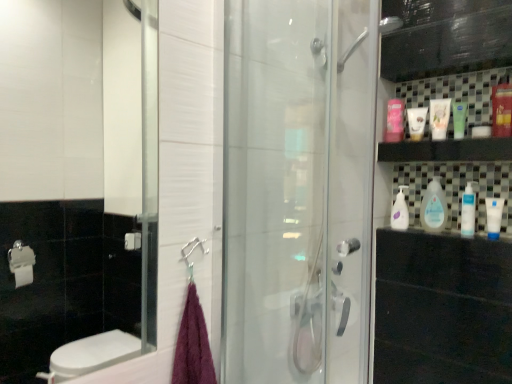
The height and width of the screenshot is (384, 512). What do you see at coordinates (298, 190) in the screenshot?
I see `transparent glass shower door at center` at bounding box center [298, 190].

From the picture: In order to face green matte tube at upper right, which is the third mouthwash in right-to-left order, should I rotate leftwards or rightwards?

It's best to rotate right around 25.466 degrees.

What is the approximate height of green matte tube at upper right, arranged as the 4th mouthwash when viewed from the left?

5.98 inches.

In order to face clear plastic bottle at center, acting as the second cleaning product starting from the front, should I rotate leftwards or rightwards?

Rotate your view right by about 22.633°.

The height and width of the screenshot is (384, 512). What do you see at coordinates (502, 110) in the screenshot?
I see `red plastic mouthwash at upper right, which ranks as the 1th mouthwash in right-to-left order` at bounding box center [502, 110].

Locate an element on the screen. The width and height of the screenshot is (512, 384). blue matte tube at right, acting as the second mouthwash starting from the right is located at coordinates (494, 216).

From the image's perspective, which one is positioned higher, purple fluffy towel at lower left or transparent glass shower door at center?

transparent glass shower door at center is shown above in the image.

Based on the photo, which object is further away from the camera, purple fluffy towel at lower left or transparent glass shower door at center?

purple fluffy towel at lower left is further from the camera.

Does purple fluffy towel at lower left have a greater width compared to transparent glass shower door at center?

No.

Is clear plastic bottle at center, the second cleaning product positioned from the right, located within blue matte tube at right, positioned as the fifth mouthwash in left-to-right order?

No, clear plastic bottle at center, the second cleaning product positioned from the right, is not inside blue matte tube at right, positioned as the fifth mouthwash in left-to-right order.

Is blue matte tube at right, positioned as the fifth mouthwash in left-to-right order, facing away from clear plastic bottle at center, marked as the 2th cleaning product in a back-to-front arrangement?

That's not correct — blue matte tube at right, positioned as the fifth mouthwash in left-to-right order, is not looking away from clear plastic bottle at center, marked as the 2th cleaning product in a back-to-front arrangement.

Based on the photo, considering the relative positions of blue matte tube at right, positioned as the fifth mouthwash in left-to-right order, and clear plastic bottle at center, marked as the 2th cleaning product in a back-to-front arrangement, in the image provided, is blue matte tube at right, positioned as the fifth mouthwash in left-to-right order, to the left of clear plastic bottle at center, marked as the 2th cleaning product in a back-to-front arrangement, from the viewer's perspective?

Incorrect, blue matte tube at right, positioned as the fifth mouthwash in left-to-right order, is not on the left side of clear plastic bottle at center, marked as the 2th cleaning product in a back-to-front arrangement.

Is point (489, 201) closer to viewer compared to point (422, 207)?

Yes, point (489, 201) is closer to viewer.

From the image's perspective, is pink glossy mouthwash at upper right, the sixth mouthwash when ordered from right to left, beneath clear plastic bottle at center, the second cleaning product positioned from the right?

No, from the image's perspective, pink glossy mouthwash at upper right, the sixth mouthwash when ordered from right to left, is not below clear plastic bottle at center, the second cleaning product positioned from the right.

Would you say pink glossy mouthwash at upper right, the sixth mouthwash when ordered from right to left, is outside clear plastic bottle at center, marked as the 2th cleaning product in a back-to-front arrangement?

Yes, pink glossy mouthwash at upper right, the sixth mouthwash when ordered from right to left, is outside of clear plastic bottle at center, marked as the 2th cleaning product in a back-to-front arrangement.

From their relative heights in the image, would you say pink glossy mouthwash at upper right, marked as the 1th mouthwash in a left-to-right arrangement, is taller or shorter than clear plastic bottle at center, the second cleaning product positioned from the right?

Clearly, pink glossy mouthwash at upper right, marked as the 1th mouthwash in a left-to-right arrangement, is shorter compared to clear plastic bottle at center, the second cleaning product positioned from the right.

Identify the location of the 1st cleaning product below the pink glossy mouthwash at upper right, marked as the 1th mouthwash in a left-to-right arrangement (from the image's perspective). (434, 207).

Can you confirm if white matte tube at upper right, the 2th mouthwash in the left-to-right sequence, is bigger than red plastic mouthwash at upper right, which is counted as the 6th mouthwash, starting from the left?

No, white matte tube at upper right, the 2th mouthwash in the left-to-right sequence, is not bigger than red plastic mouthwash at upper right, which is counted as the 6th mouthwash, starting from the left.

Is point (414, 126) closer to camera compared to point (493, 123)?

No, it is behind (493, 123).

Between white matte tube at upper right, the 2th mouthwash in the left-to-right sequence, and red plastic mouthwash at upper right, which ranks as the 1th mouthwash in right-to-left order, which one has larger width?

red plastic mouthwash at upper right, which ranks as the 1th mouthwash in right-to-left order.

From the image's perspective, is white matte tube at upper right, the 5th mouthwash when ordered from right to left, on red plastic mouthwash at upper right, which is counted as the 6th mouthwash, starting from the left?

Incorrect, from the image's perspective, white matte tube at upper right, the 5th mouthwash when ordered from right to left, is lower than red plastic mouthwash at upper right, which is counted as the 6th mouthwash, starting from the left.

Is transparent glass shower door at center bigger or smaller than red plastic mouthwash at upper right, which ranks as the 1th mouthwash in right-to-left order?

transparent glass shower door at center is bigger than red plastic mouthwash at upper right, which ranks as the 1th mouthwash in right-to-left order.

Is transparent glass shower door at center in front of or behind red plastic mouthwash at upper right, which ranks as the 1th mouthwash in right-to-left order, in the image?

transparent glass shower door at center is in front of red plastic mouthwash at upper right, which ranks as the 1th mouthwash in right-to-left order.

From the image's perspective, is clear plastic bottle at center, the 2th cleaning product positioned from the left, located beneath green matte tube at upper right, arranged as the 4th mouthwash when viewed from the left?

Yes, from the image's perspective, clear plastic bottle at center, the 2th cleaning product positioned from the left, is below green matte tube at upper right, arranged as the 4th mouthwash when viewed from the left.

Can you tell me how much clear plastic bottle at center, the 2th cleaning product positioned from the left, and green matte tube at upper right, which is the third mouthwash in right-to-left order, differ in facing direction?

They differ by 0.00483 degrees in their facing directions.

From the green matte tube at upper right, which is the third mouthwash in right-to-left order, count 2nd cleaning products backward and point to it. Please provide its 2D coordinates.

[(434, 207)]

Looking at the image, does blue matte tube at right, positioned as the fifth mouthwash in left-to-right order, seem bigger or smaller compared to white glossy tube at upper right, the fourth mouthwash positioned from the right?

Considering their sizes, blue matte tube at right, positioned as the fifth mouthwash in left-to-right order, takes up less space than white glossy tube at upper right, the fourth mouthwash positioned from the right.

Are blue matte tube at right, positioned as the fifth mouthwash in left-to-right order, and white glossy tube at upper right, the fourth mouthwash positioned from the right, far apart?

blue matte tube at right, positioned as the fifth mouthwash in left-to-right order, is near white glossy tube at upper right, the fourth mouthwash positioned from the right, not far away.

Does blue matte tube at right, acting as the second mouthwash starting from the right, have a greater height compared to white glossy tube at upper right, the fourth mouthwash positioned from the right?

In fact, blue matte tube at right, acting as the second mouthwash starting from the right, may be shorter than white glossy tube at upper right, the fourth mouthwash positioned from the right.

Is blue matte tube at right, acting as the second mouthwash starting from the right, aimed at white glossy tube at upper right, arranged as the third mouthwash when viewed from the left?

No, blue matte tube at right, acting as the second mouthwash starting from the right, does not turn towards white glossy tube at upper right, arranged as the third mouthwash when viewed from the left.

Locate an element on the screen. The image size is (512, 384). screen door above the purple fluffy towel at lower left (from a real-world perspective) is located at coordinates (298, 190).

This screenshot has height=384, width=512. I want to click on the 2nd cleaning product to the left when counting from the blue matte tube at right, acting as the second mouthwash starting from the right, so click(x=434, y=207).

Estimate the real-world distances between objects in this image. Which object is closer to green matte tube at upper right, which is the third mouthwash in right-to-left order, clear plastic bottle at center, marked as the 2th cleaning product in a back-to-front arrangement, or purple fluffy towel at lower left?

Among the two, clear plastic bottle at center, marked as the 2th cleaning product in a back-to-front arrangement, is located nearer to green matte tube at upper right, which is the third mouthwash in right-to-left order.

From the image, which object appears to be nearer to white glossy bottle at upper right, the first cleaning product viewed from the left, clear plastic bottle at center, the 2th cleaning product positioned from the left, or blue matte tube at right, positioned as the fifth mouthwash in left-to-right order?

clear plastic bottle at center, the 2th cleaning product positioned from the left, is closer to white glossy bottle at upper right, the first cleaning product viewed from the left.

Looking at the image, which one is located closer to white matte tube at upper right, the 5th mouthwash when ordered from right to left, white glossy bottle at right, which is counted as the 1th cleaning product, starting from the front, or clear plastic bottle at center, the 2th cleaning product positioned from the left?

clear plastic bottle at center, the 2th cleaning product positioned from the left, lies closer to white matte tube at upper right, the 5th mouthwash when ordered from right to left, than the other object.

From the image, which object appears to be nearer to purple fluffy towel at lower left, blue matte tube at right, positioned as the fifth mouthwash in left-to-right order, or green matte tube at upper right, arranged as the 4th mouthwash when viewed from the left?

blue matte tube at right, positioned as the fifth mouthwash in left-to-right order, lies closer to purple fluffy towel at lower left than the other object.

Looking at the image, which one is located further to blue matte tube at right, acting as the second mouthwash starting from the right, purple fluffy towel at lower left or white glossy tube at upper right, arranged as the third mouthwash when viewed from the left?

Based on the image, purple fluffy towel at lower left appears to be further to blue matte tube at right, acting as the second mouthwash starting from the right.

Which object lies further to the anchor point green matte tube at upper right, arranged as the 4th mouthwash when viewed from the left, white glossy bottle at upper right, which is the third cleaning product from front to back, or clear plastic bottle at center, marked as the 2th cleaning product in a back-to-front arrangement?

white glossy bottle at upper right, which is the third cleaning product from front to back, lies further to green matte tube at upper right, arranged as the 4th mouthwash when viewed from the left, than the other object.

Estimate the real-world distances between objects in this image. Which object is further from red plastic mouthwash at upper right, which is counted as the 6th mouthwash, starting from the left, white glossy tube at upper right, the fourth mouthwash positioned from the right, or clear plastic bottle at center, marked as the 2th cleaning product in a back-to-front arrangement?

The object further to red plastic mouthwash at upper right, which is counted as the 6th mouthwash, starting from the left, is clear plastic bottle at center, marked as the 2th cleaning product in a back-to-front arrangement.

Which object lies further to the anchor point white glossy tube at upper right, the fourth mouthwash positioned from the right, purple fluffy towel at lower left or pink glossy mouthwash at upper right, the sixth mouthwash when ordered from right to left?

purple fluffy towel at lower left.

You are a GUI agent. You are given a task and a screenshot of the screen. Output one action in this format:
    pyautogui.click(x=<x>, y=<y>)
    Task: Click on the bath towel between transparent glass shower door at center and pink glossy mouthwash at upper right, the sixth mouthwash when ordered from right to left, from front to back
    This screenshot has width=512, height=384.
    Given the screenshot: What is the action you would take?
    pyautogui.click(x=193, y=345)

At what (x,y) coordinates should I click in order to perform the action: click on screen door between purple fluffy towel at lower left and blue matte tube at right, acting as the second mouthwash starting from the right. Please return your answer as a coordinate pair (x, y). Looking at the image, I should click on (298, 190).

Locate an element on the screen. The height and width of the screenshot is (384, 512). cleaning product between transparent glass shower door at center and clear plastic bottle at center, acting as the second cleaning product starting from the front, along the z-axis is located at coordinates (468, 210).

Identify the location of mouthwash between transparent glass shower door at center and blue matte tube at right, positioned as the fifth mouthwash in left-to-right order, in the front-back direction. (502, 110).